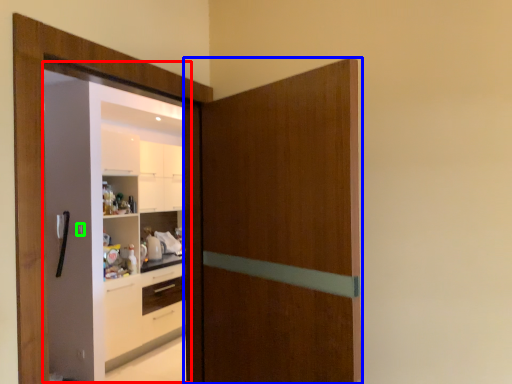
Question: Which object is the farthest from screen door (highlighted by a red box)? Choose among these: door (highlighted by a blue box) or door handle (highlighted by a green box).

Choices:
 (A) door
 (B) door handle

Answer: (A)